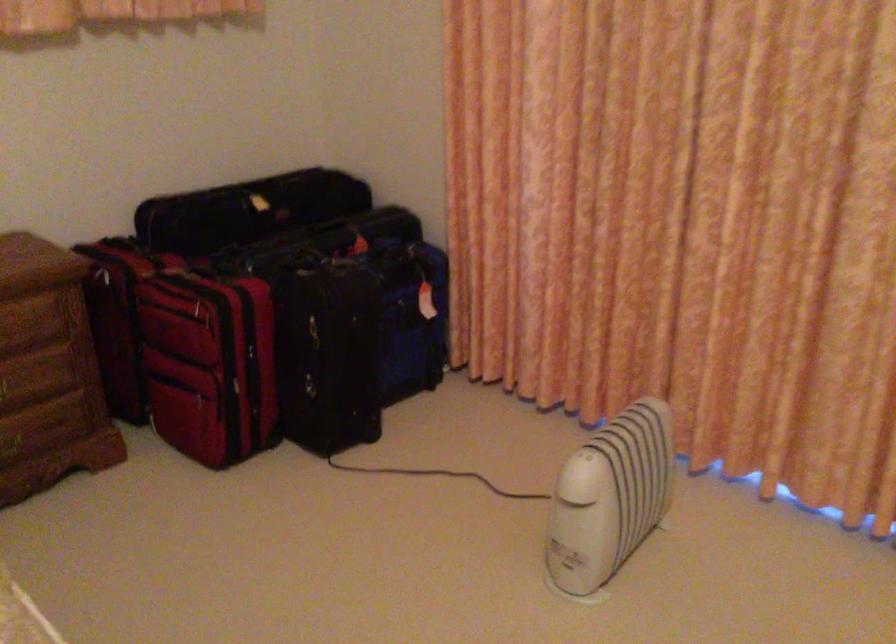
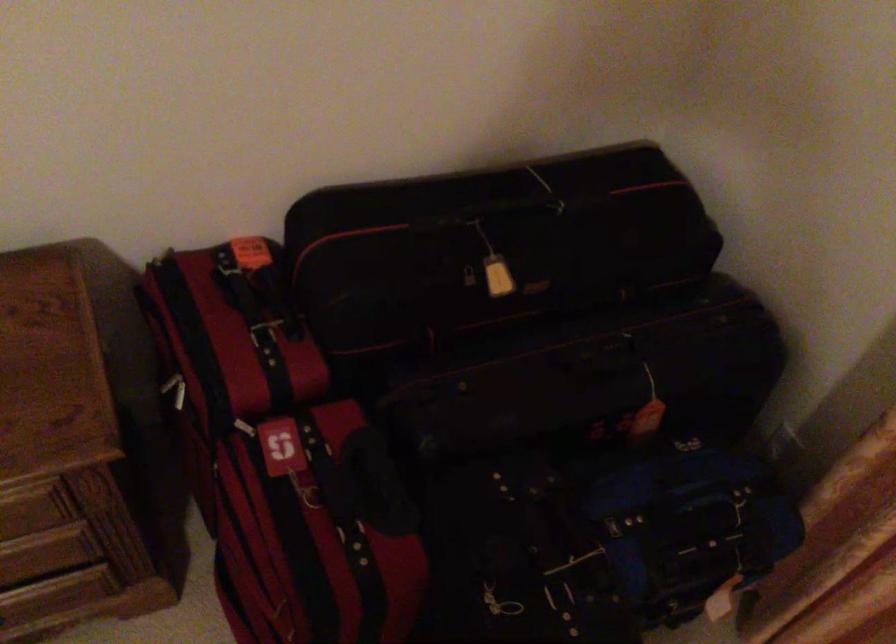
In the second image, find the point that corresponds to [383,249] in the first image.

(676, 507)